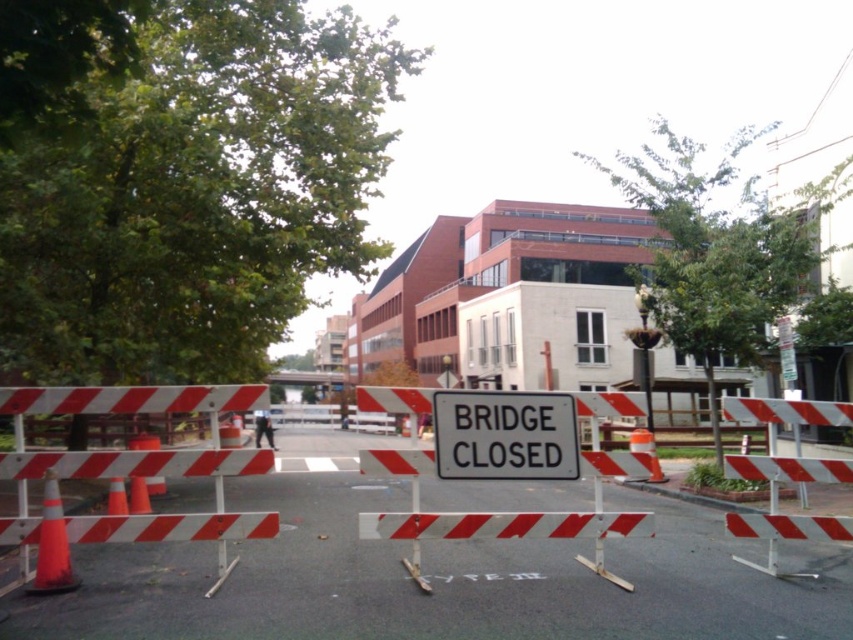
You are a delivery driver who needs to pass through the road blocked by the white striped barricade at center. The distance between you and the barricade is 18.44 feet. Your truck requires a minimum of 20 feet to safely stop. Can you safely stop before hitting the barricade?

The distance between you and the white striped barricade at center is 18.44 feet, which is less than the required 20 feet to safely stop. Therefore, you cannot safely stop before hitting the barricade.

You are a delivery driver who needs to take a photo of the white metal barricade at center for your report. Your camera has a maximum focus range of 20 feet. Can you capture a clear photo from your current position without moving closer?

The white metal barricade at center is 21.19 feet away from the camera, which exceeds the maximum focus range of 20 feet. Therefore, you cannot capture a clear photo without moving closer.